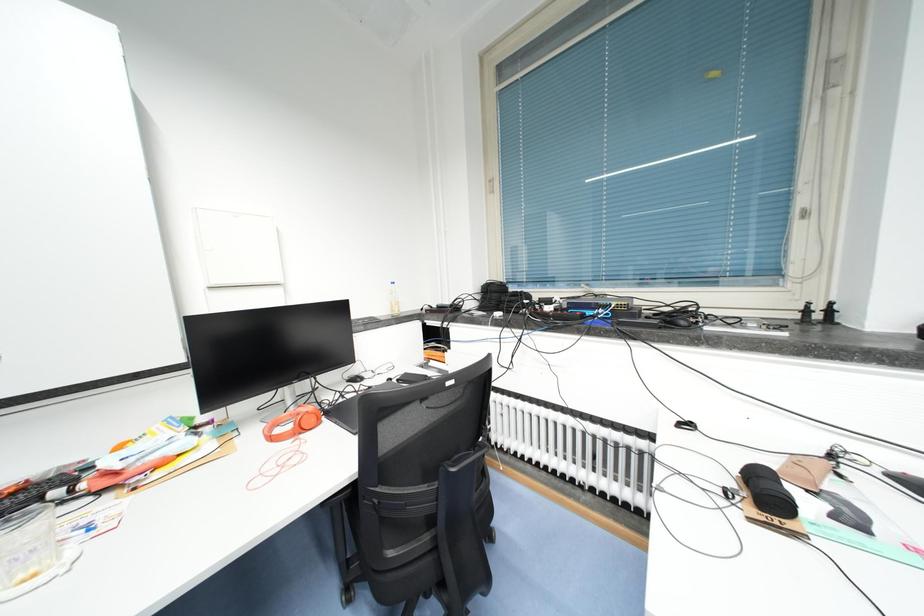
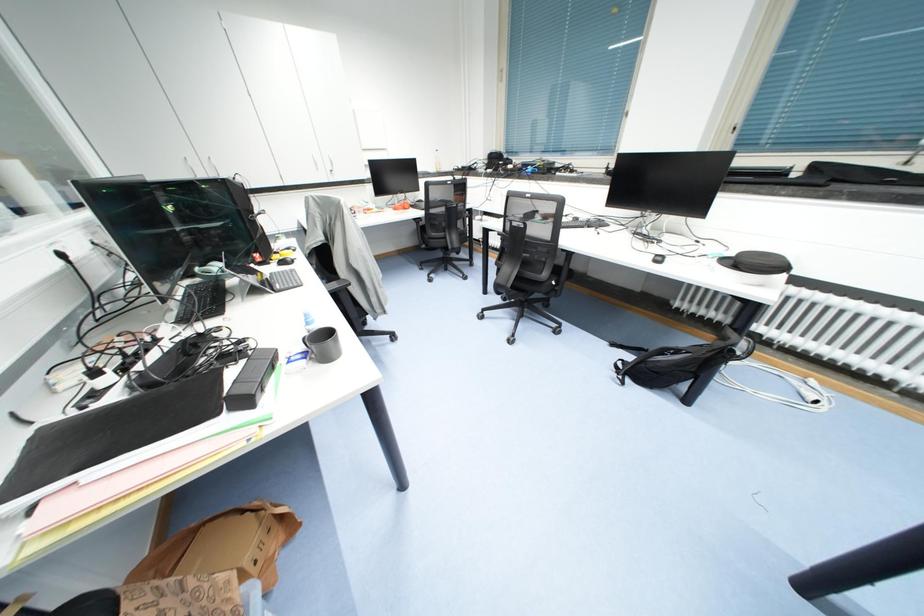
Question: Which direction would the cameraman need to move to produce the second image? Reply with the corresponding letter.

Choices:
 (A) Left
 (B) Right
 (C) Forward
 (D) Backward

Answer: (D)